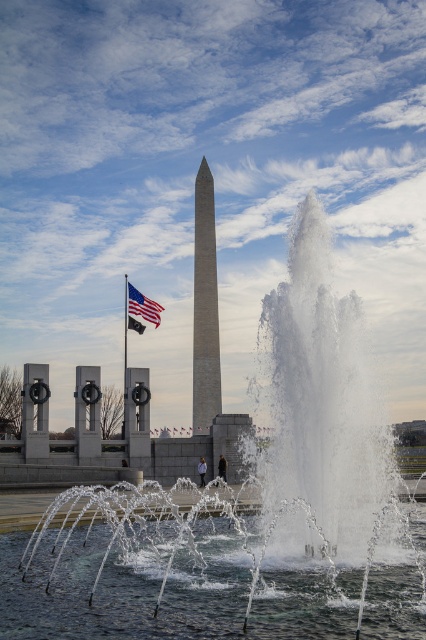
Question: Does white water at center have a smaller size compared to american flag at center?

Choices:
 (A) no
 (B) yes

Answer: (A)

Question: Which object is the farthest from the american flag at center?

Choices:
 (A) clear water at center
 (B) smooth gray obelisk at center

Answer: (A)

Question: Is white water at center below american flag at center?

Choices:
 (A) yes
 (B) no

Answer: (A)

Question: Is white water at center to the left of clear water at center from the viewer's perspective?

Choices:
 (A) yes
 (B) no

Answer: (A)

Question: Which point is farther from the camera taking this photo?

Choices:
 (A) pyautogui.click(x=132, y=628)
 (B) pyautogui.click(x=365, y=632)

Answer: (B)

Question: Which point is closer to the camera taking this photo?

Choices:
 (A) (212, 333)
 (B) (420, 556)
 (C) (216, 625)
 (D) (131, 314)

Answer: (C)